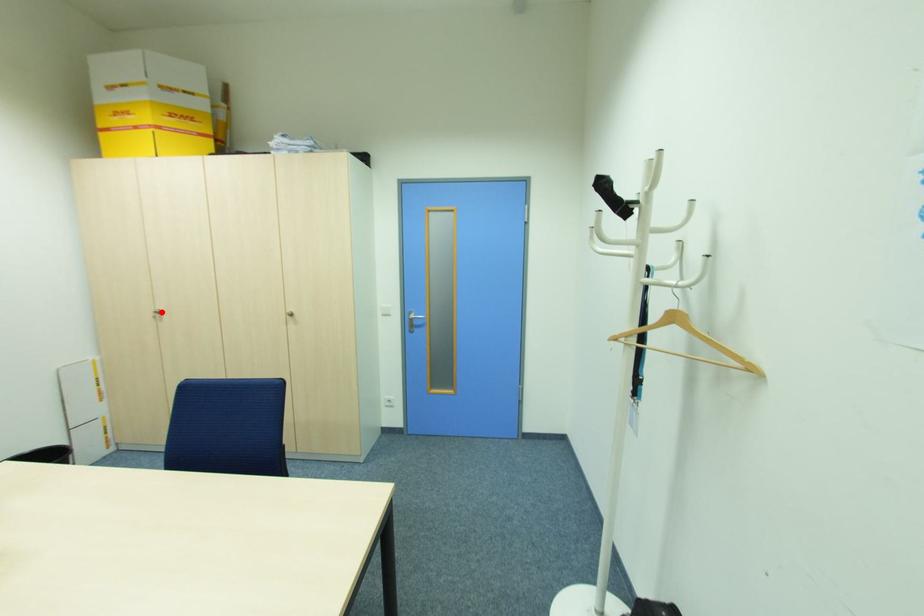
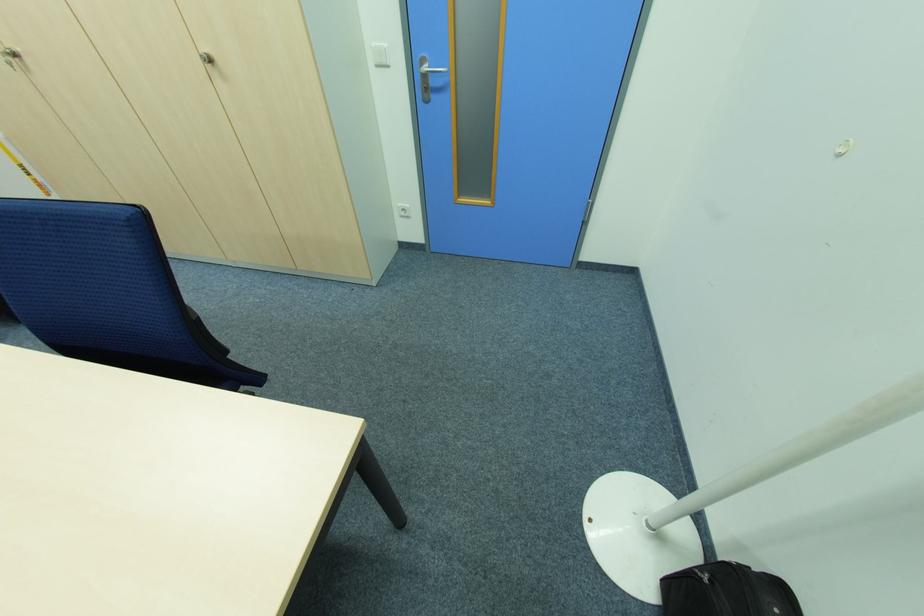
Where in the second image is the point corresponding to the highlighted location from the first image?

(18, 55)